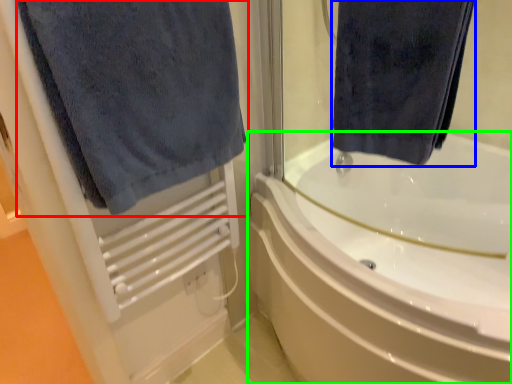
Question: Estimate the real-world distances between objects in this image. Which object is farther from towel (highlighted by a red box), towel (highlighted by a blue box) or bathtub (highlighted by a green box)?

Choices:
 (A) towel
 (B) bathtub

Answer: (B)